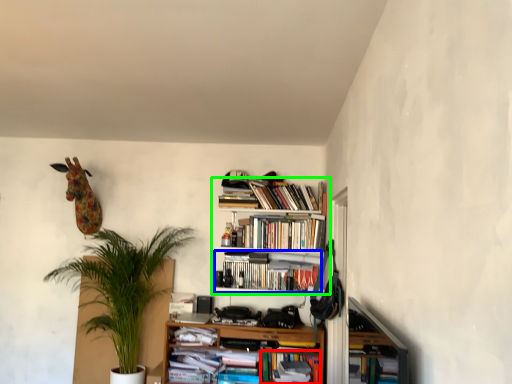
Question: Based on their relative distances, which object is farther from book (highlighted by a red box)? Choose from book (highlighted by a blue box) and bookcase (highlighted by a green box).

Choices:
 (A) book
 (B) bookcase

Answer: (B)